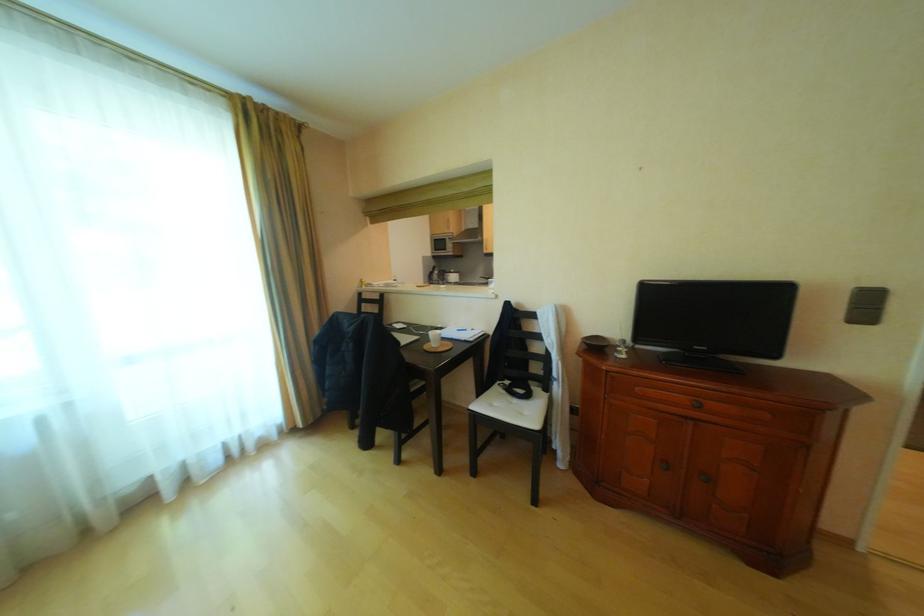
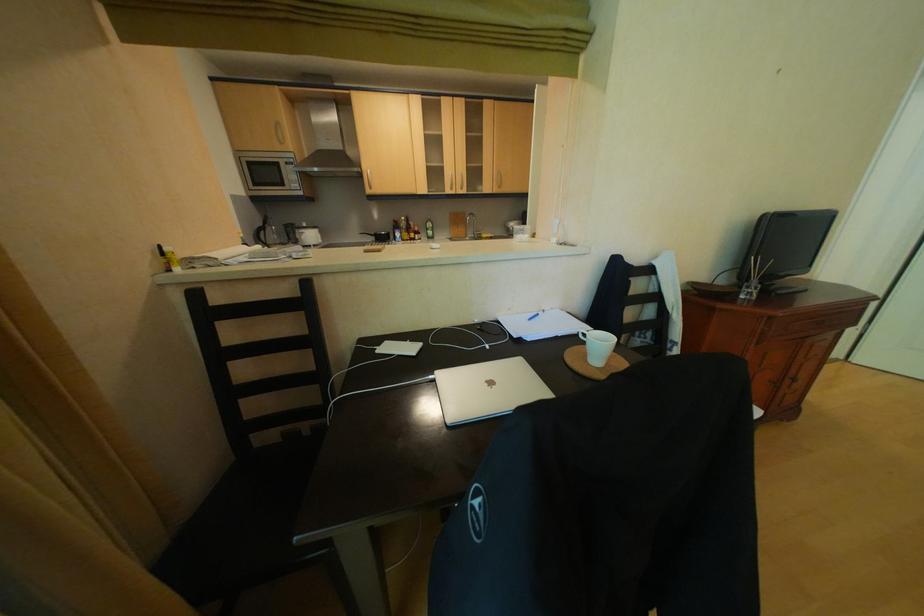
The point at (463, 251) is marked in the first image. Where is the corresponding point in the second image?

(310, 187)